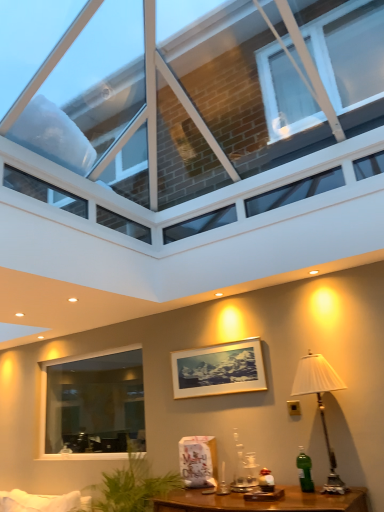
Question: From the image's perspective, is transparent glass roof at upper center, placed as the 2th window when sorted from back to front, located above or below gold-framed picture at center?

Choices:
 (A) above
 (B) below

Answer: (A)

Question: Considering the positions of transparent glass roof at upper center, placed as the 2th window when sorted from back to front, and gold-framed picture at center in the image, is transparent glass roof at upper center, placed as the 2th window when sorted from back to front, bigger or smaller than gold-framed picture at center?

Choices:
 (A) big
 (B) small

Answer: (A)

Question: Estimate the real-world distances between objects in this image. Which object is closer to the gold-framed picture at center?

Choices:
 (A) green glass bottle at lower right
 (B) clear glass window at lower left, the 2th window positioned from the top
 (C) transparent glass roof at upper center, the 1th window viewed from the top
 (D) white fabric lampshade at right

Answer: (D)

Question: Which is farther from the clear glass window at lower left, positioned as the second window in front-to-back order?

Choices:
 (A) white fabric lampshade at right
 (B) gold-framed picture at center
 (C) transparent glass roof at upper center, the 1th window positioned from the front
 (D) green glass bottle at lower right

Answer: (C)